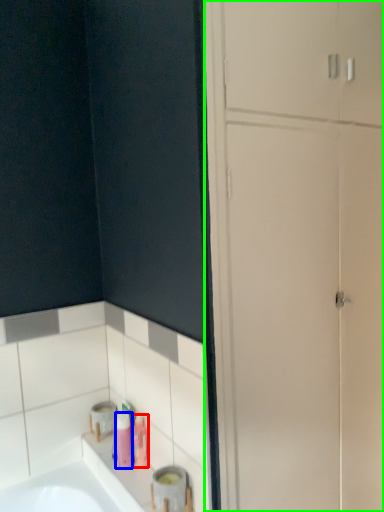
Question: Estimate the real-world distances between objects in this image. Which object is closer to toiletry (highlighted by a red box), toiletry (highlighted by a blue box) or dresser (highlighted by a green box)?

Choices:
 (A) toiletry
 (B) dresser

Answer: (A)